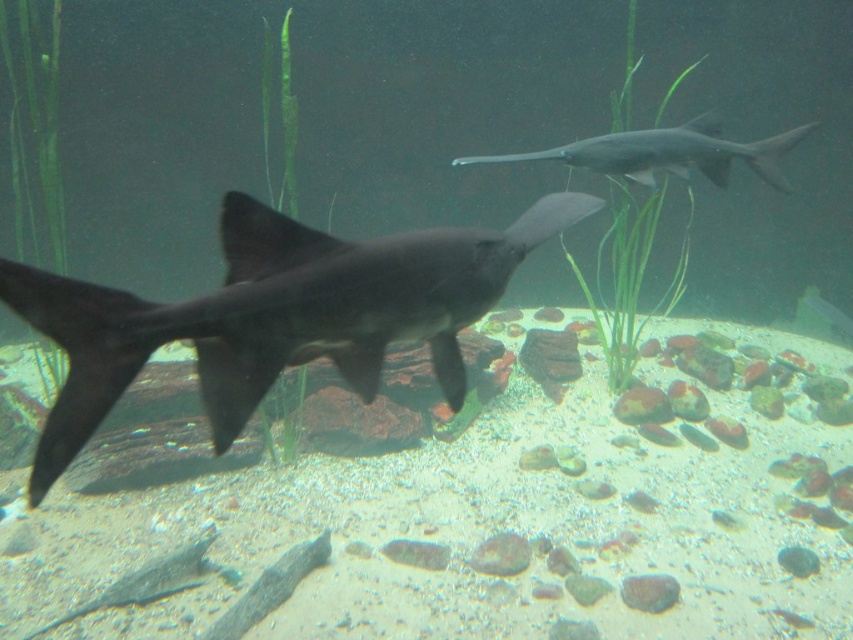
Question: Does matte black shark at center come in front of smooth gray shark at upper center?

Choices:
 (A) no
 (B) yes

Answer: (B)

Question: Which point is farther to the camera?

Choices:
 (A) smooth gray shark at upper center
 (B) matte black shark at center

Answer: (A)

Question: Is matte black shark at center below smooth gray shark at upper center?

Choices:
 (A) no
 (B) yes

Answer: (B)

Question: Which point is closer to the camera taking this photo?

Choices:
 (A) (612, 147)
 (B) (125, 352)

Answer: (B)

Question: Observing the image, what is the correct spatial positioning of matte black shark at center in reference to smooth gray shark at upper center?

Choices:
 (A) above
 (B) below

Answer: (B)